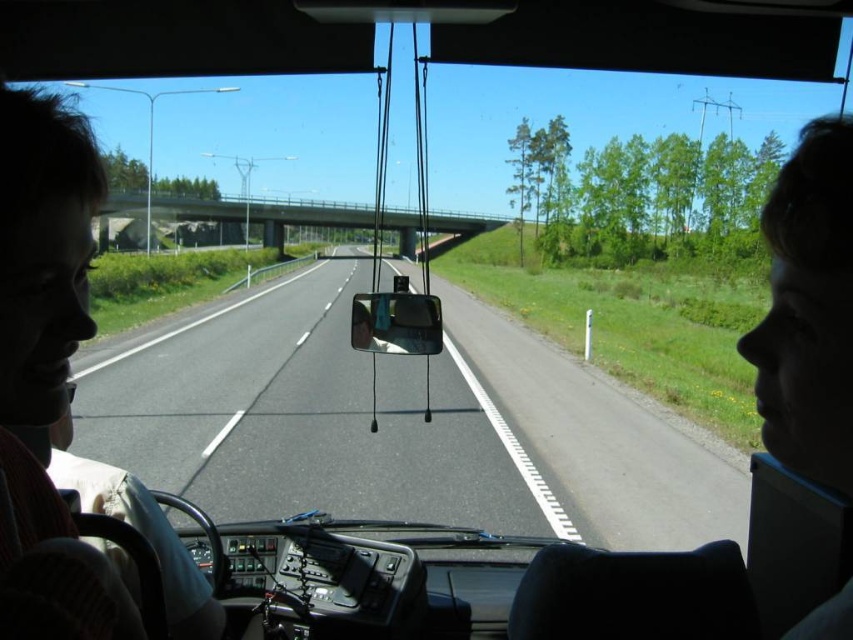
You are a passenger in the bus and want to look at the road ahead. Which object, the asphalt road at center or the clear glass view mirror at center, is located lower from your viewpoint?

The asphalt road at center is positioned under the clear glass view mirror at center, so the asphalt road at center is lower from your viewpoint.

You are a passenger in the vehicle and notice the asphalt road at center and the matte black hair at left. Which object is located to the left of the other?

The asphalt road at center is positioned on the left side of matte black hair at left, so the asphalt road at center is to the left of the matte black hair at left.

You are a passenger in the bus and want to know what is located exactly at the point with coordinates (306, 419) in the image. According to the scene, what would you find there?

The point at coordinates (306, 419) corresponds to the asphalt road at center.